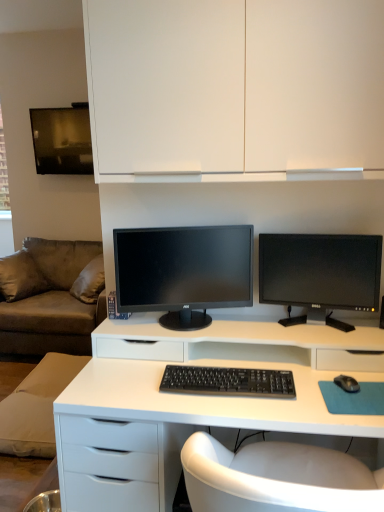
Question: Based on their sizes in the image, would you say black glossy monitor at center right, placed as the first computer monitor when sorted from right to left, is bigger or smaller than brown fabric couch at left?

Choices:
 (A) small
 (B) big

Answer: (A)

Question: From a real-world perspective, relative to brown fabric couch at left, is black glossy monitor at center right, which appears as the second computer monitor when viewed from the left, vertically above or below?

Choices:
 (A) above
 (B) below

Answer: (A)

Question: Estimate the real-world distances between objects in this image. Which object is farther from the black plastic keyboard at center?

Choices:
 (A) white matte desk at center
 (B) black matte mouse at lower right
 (C) black glossy monitor at center right, placed as the first computer monitor when sorted from right to left
 (D) matte black monitor at center, arranged as the 1th computer monitor when viewed from the left
 (E) brown fabric couch at left

Answer: (E)

Question: Which object is positioned farthest from the black glossy monitor at center right, which appears as the second computer monitor when viewed from the left?

Choices:
 (A) white matte cabinet at upper center
 (B) brown fabric couch at left
 (C) matte black monitor at center, which appears as the second computer monitor when viewed from the right
 (D) white matte desk at center
 (E) black plastic keyboard at center

Answer: (B)